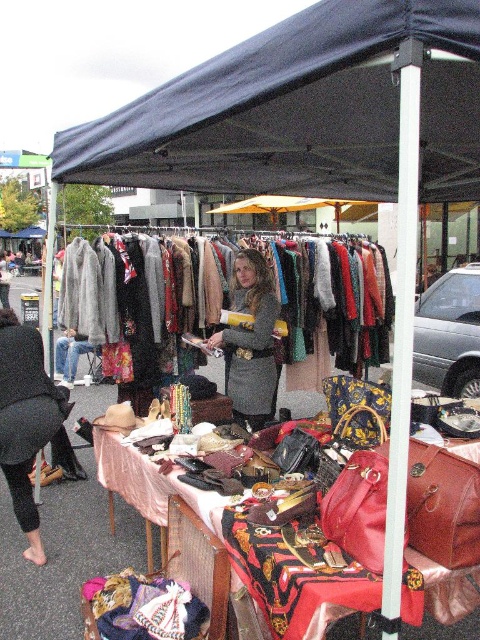
You are a customer at the market stall and want to buy a hat. You see the dark blue fabric canopy at upper center and the black knit hat at lower left. Which object is closer to the right side of the stall?

The dark blue fabric canopy at upper center is closer to the right side of the stall because it is positioned to the right of the black knit hat at lower left.

You are a customer at the market stall and want to know if the dark blue fabric canopy at upper center can provide shade over the velvet floral dress at center. Based on their sizes, can the canopy cover the dress completely?

The dark blue fabric canopy at upper center is wider than the velvet floral dress at center, so yes, the canopy can provide full shade over the velvet floral dress at center.